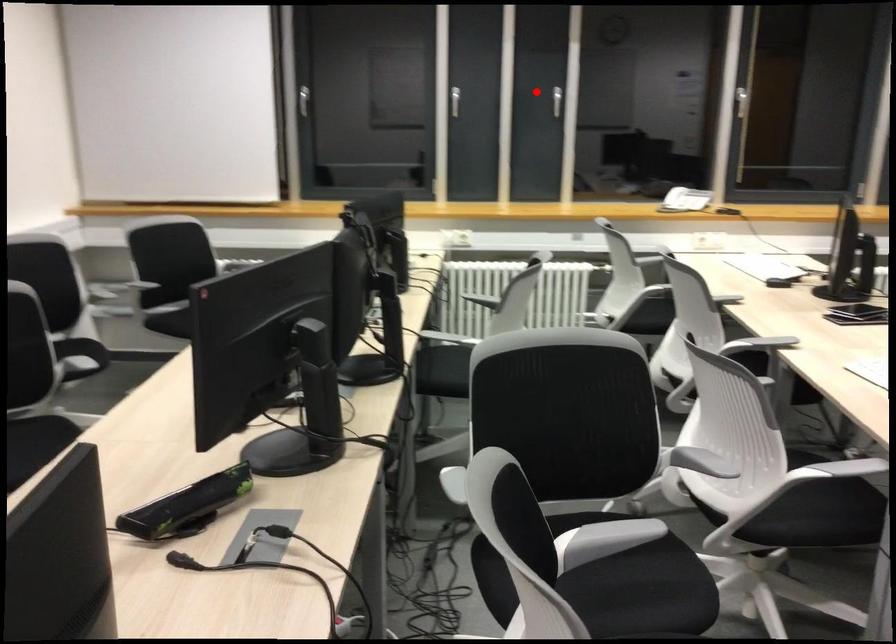
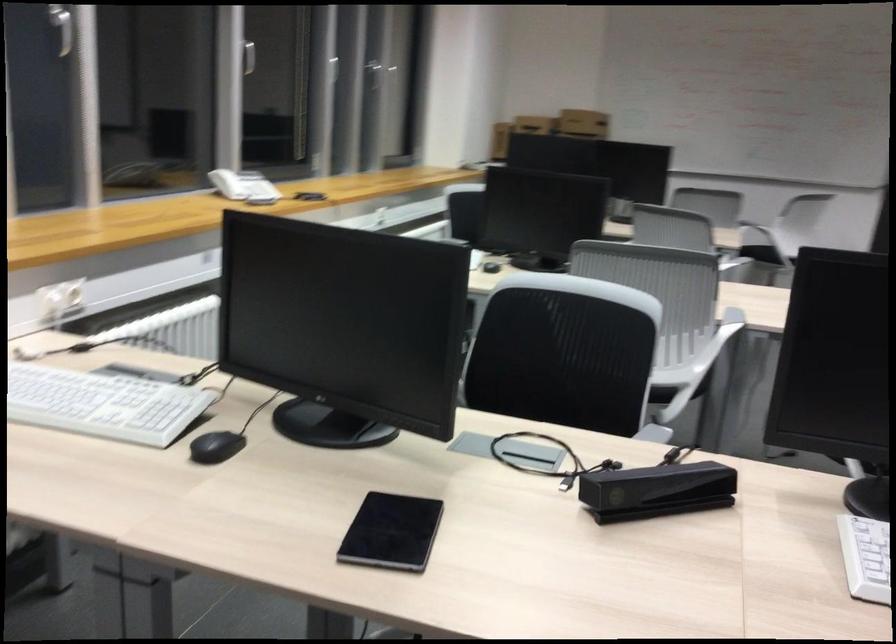
Question: I am providing you with two images of the same scene from different viewpoints. Given a red point in image1, look at the same physical point in image2. Is it:

Choices:
 (A) Closer to the viewpoint
 (B) Farther from the viewpoint

Answer: (A)